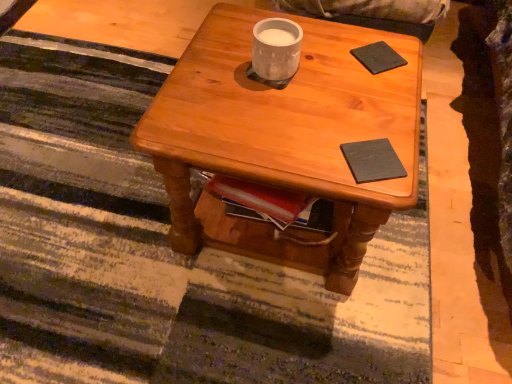
This screenshot has height=384, width=512. I want to click on vacant space in front of white matte cup at center, so click(x=267, y=120).